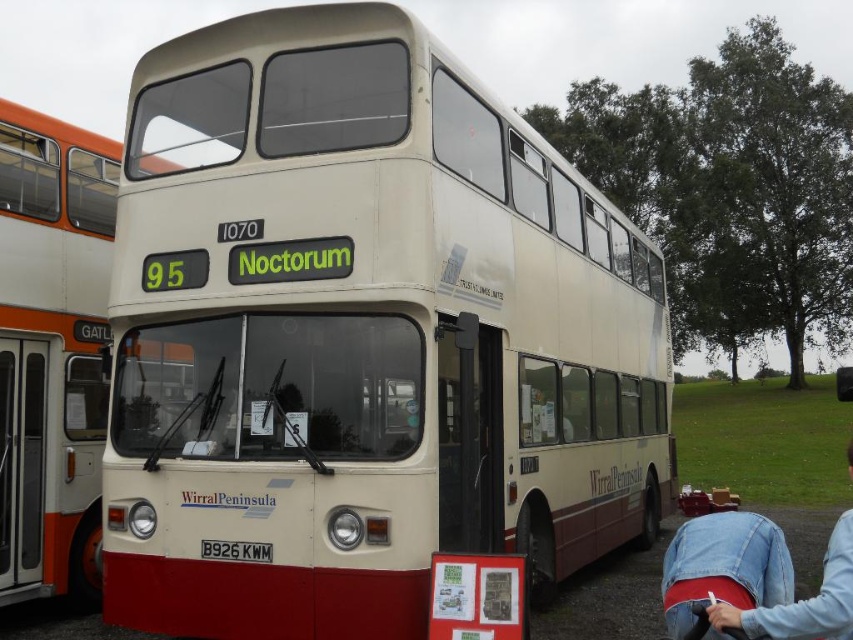
Question: Estimate the real-world distances between objects in this image. Which object is farther from the denim jacket at lower right?

Choices:
 (A) matte cream double-decker bus at center
 (B) wooden baby carriage at lower right

Answer: (A)

Question: Which of the following is the closest to the observer?

Choices:
 (A) wooden baby carriage at lower right
 (B) matte cream double-decker bus at center
 (C) denim jacket at lower right

Answer: (C)

Question: Can you confirm if matte cream double-decker bus at center is bigger than white glossy bus at center?

Choices:
 (A) no
 (B) yes

Answer: (A)

Question: Does white glossy bus at center lie in front of denim jacket at lower right?

Choices:
 (A) yes
 (B) no

Answer: (B)

Question: In this image, where is matte cream double-decker bus at center located relative to wooden baby carriage at lower right?

Choices:
 (A) above
 (B) below

Answer: (A)

Question: Which object appears farthest from the camera in this image?

Choices:
 (A) wooden baby carriage at lower right
 (B) matte cream double-decker bus at center
 (C) white glossy bus at center
 (D) denim jacket at lower right

Answer: (A)